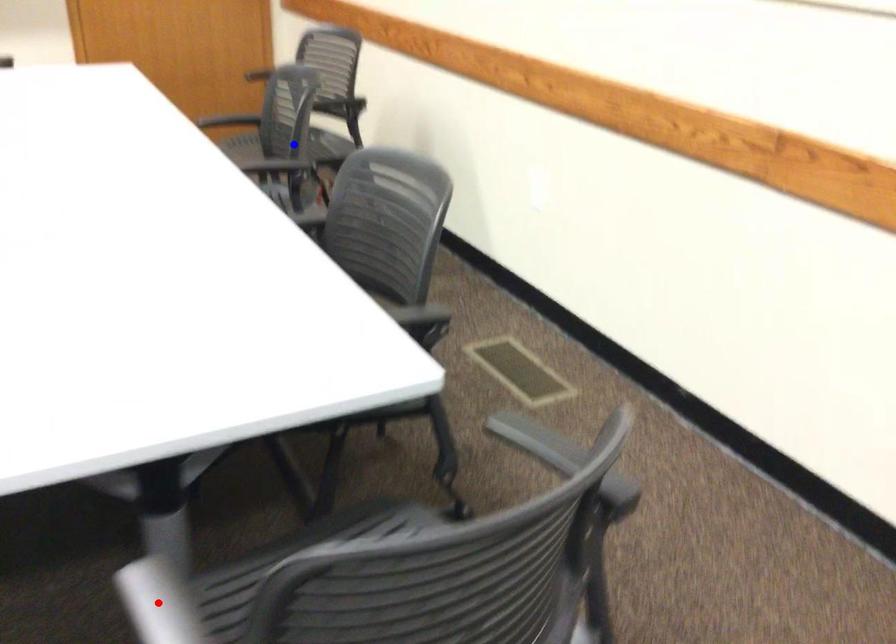
Question: Which of the two points in the image is closer to the camera?

Choices:
 (A) Blue point is closer.
 (B) Red point is closer.

Answer: (B)